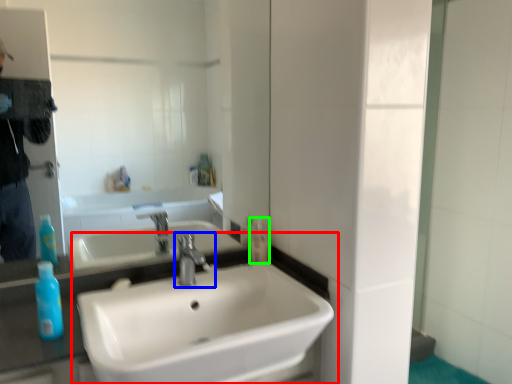
Question: Considering the real-world distances, which object is farthest from sink (highlighted by a red box)? tap (highlighted by a blue box) or mouthwash (highlighted by a green box)?

Choices:
 (A) tap
 (B) mouthwash

Answer: (B)